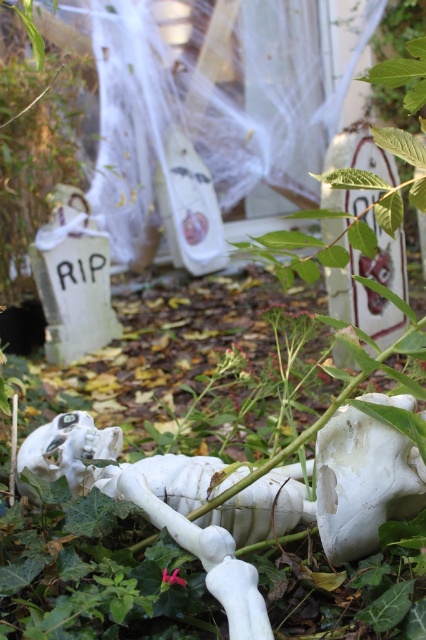
Consider the image. Is white matte skull at lower center bigger than white matte skull at center?

Yes, white matte skull at lower center is bigger than white matte skull at center.

Which is in front, point (385, 451) or point (71, 456)?

Point (385, 451) is in front.

You are a GUI agent. You are given a task and a screenshot of the screen. Output one action in this format:
    pyautogui.click(x=<x>, y=<y>)
    Task: Click on the white matte skull at lower center
    The height and width of the screenshot is (640, 426).
    Given the screenshot: What is the action you would take?
    pyautogui.click(x=362, y=483)